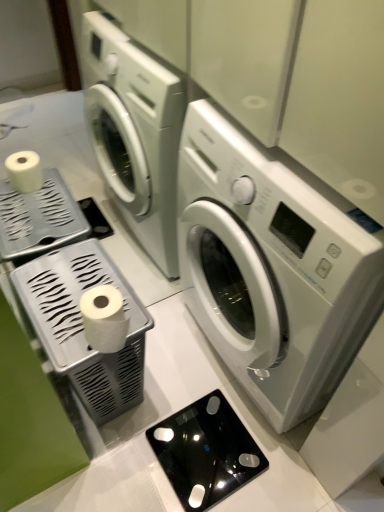
Question: In which direction should I rotate to look at black glass scale at lower center, the 1th appliance in the right-to-left sequence?

Choices:
 (A) right
 (B) left

Answer: (A)

Question: Considering the relative sizes of white plastic tissue holder at left, arranged as the 1th appliance when viewed from the left, and white glossy washing machine at center in the image provided, is white plastic tissue holder at left, arranged as the 1th appliance when viewed from the left, taller than white glossy washing machine at center?

Choices:
 (A) yes
 (B) no

Answer: (B)

Question: Can we say white plastic tissue holder at left, arranged as the 1th appliance when viewed from the left, lies outside white glossy washing machine at center?

Choices:
 (A) yes
 (B) no

Answer: (A)

Question: From a real-world perspective, is white plastic tissue holder at left, arranged as the 1th appliance when viewed from the left, under white glossy washing machine at center?

Choices:
 (A) yes
 (B) no

Answer: (A)

Question: Is white plastic tissue holder at left, arranged as the 1th appliance when viewed from the left, wider than white glossy washing machine at center?

Choices:
 (A) yes
 (B) no

Answer: (B)

Question: Does white plastic tissue holder at left, which is the 2th appliance from right to left, have a lesser height compared to white glossy washing machine at center?

Choices:
 (A) no
 (B) yes

Answer: (B)

Question: Can you confirm if white plastic tissue holder at left, which is the 2th appliance from right to left, is smaller than white glossy washing machine at center?

Choices:
 (A) yes
 (B) no

Answer: (A)

Question: Is white glossy toilet paper at lower left far away from black glass scale at lower center, the 1th appliance in the right-to-left sequence?

Choices:
 (A) no
 (B) yes

Answer: (A)

Question: Is black glass scale at lower center, the 1th appliance in the right-to-left sequence, inside white glossy toilet paper at lower left?

Choices:
 (A) yes
 (B) no

Answer: (B)

Question: From a real-world perspective, is white glossy toilet paper at lower left over black glass scale at lower center, placed as the 2th appliance when sorted from left to right?

Choices:
 (A) no
 (B) yes

Answer: (B)

Question: Is white glossy toilet paper at lower left to the right of black glass scale at lower center, the 1th appliance in the right-to-left sequence, from the viewer's perspective?

Choices:
 (A) yes
 (B) no

Answer: (B)

Question: Considering the relative sizes of white glossy toilet paper at lower left and black glass scale at lower center, the 1th appliance in the right-to-left sequence, in the image provided, is white glossy toilet paper at lower left thinner than black glass scale at lower center, the 1th appliance in the right-to-left sequence,?

Choices:
 (A) no
 (B) yes

Answer: (B)

Question: Can you confirm if white glossy toilet paper at lower left is wider than black glass scale at lower center, the 1th appliance in the right-to-left sequence?

Choices:
 (A) no
 (B) yes

Answer: (A)

Question: Are white plastic tissue holder at left, arranged as the 1th appliance when viewed from the left, and black glass scale at lower center, placed as the 2th appliance when sorted from left to right, far apart?

Choices:
 (A) no
 (B) yes

Answer: (A)